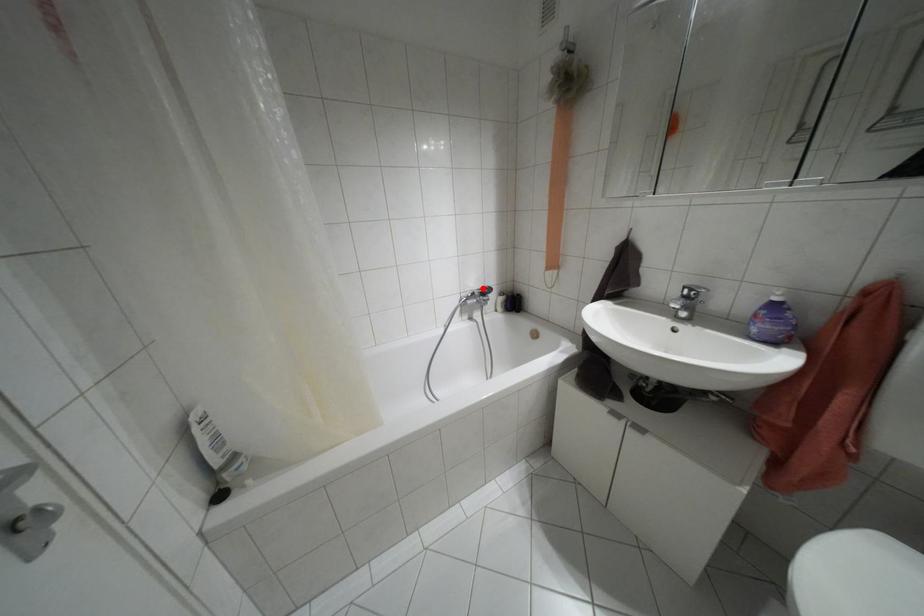
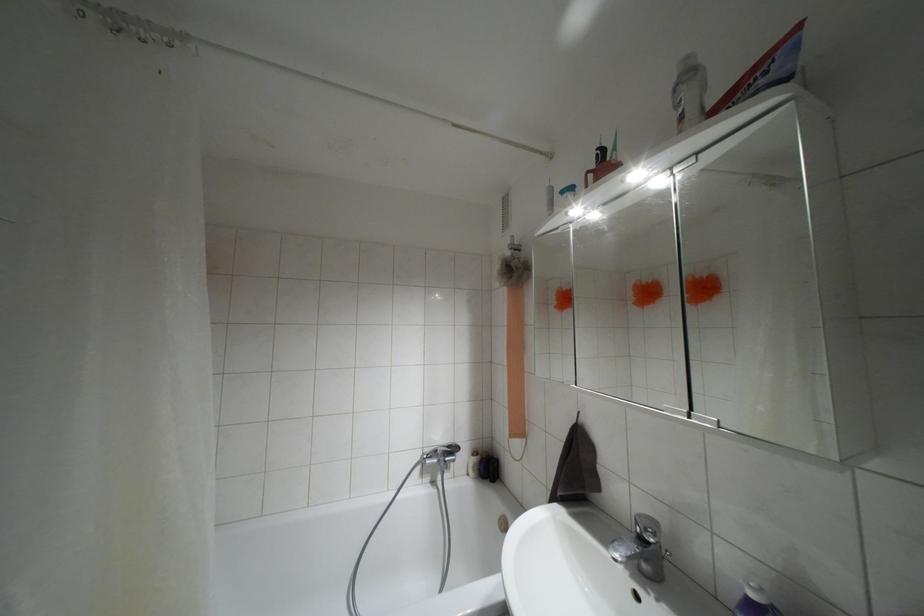
Question: I am providing you with two images of the same scene from different viewpoints. A red point is shown in image1. For the corresponding object point in image2, is it positioned nearer or farther from the camera?

Choices:
 (A) Nearer
 (B) Farther

Answer: (B)